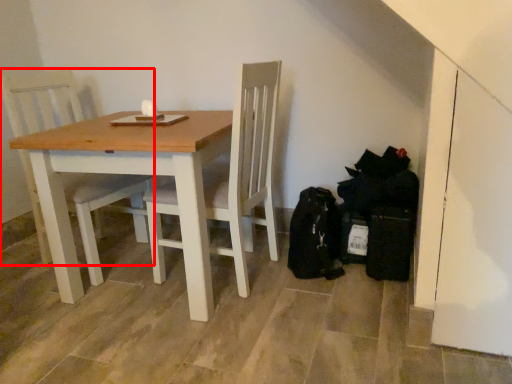
Question: From the image's perspective, where is chair (annotated by the red box) located in relation to table in the image?

Choices:
 (A) above
 (B) below

Answer: (A)